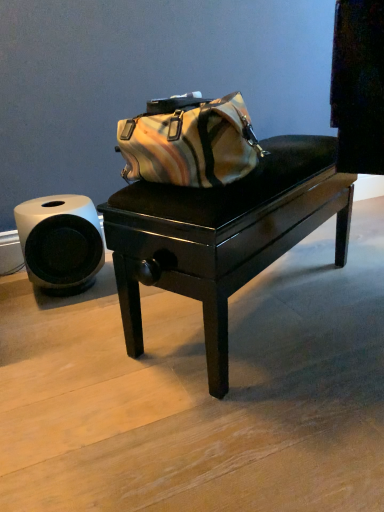
Question: From the image's perspective, is glossy black table at center over white matte toilet paper at left?

Choices:
 (A) no
 (B) yes

Answer: (B)

Question: Are glossy black table at center and white matte toilet paper at left far apart?

Choices:
 (A) no
 (B) yes

Answer: (A)

Question: From a real-world perspective, does glossy black table at center stand above white matte toilet paper at left?

Choices:
 (A) no
 (B) yes

Answer: (B)

Question: Could you tell me if glossy black table at center is turned towards white matte toilet paper at left?

Choices:
 (A) no
 (B) yes

Answer: (A)

Question: Is glossy black table at center further to camera compared to white matte toilet paper at left?

Choices:
 (A) no
 (B) yes

Answer: (A)

Question: Is glossy black table at center positioned with its back to white matte toilet paper at left?

Choices:
 (A) yes
 (B) no

Answer: (A)

Question: Can we say white matte toilet paper at left lies outside glossy black table at center?

Choices:
 (A) yes
 (B) no

Answer: (A)

Question: Is white matte toilet paper at left shorter than glossy black table at center?

Choices:
 (A) yes
 (B) no

Answer: (A)

Question: Does white matte toilet paper at left have a greater width compared to glossy black table at center?

Choices:
 (A) yes
 (B) no

Answer: (B)

Question: Considering the relative positions of white matte toilet paper at left and glossy black table at center in the image provided, is white matte toilet paper at left behind glossy black table at center?

Choices:
 (A) no
 (B) yes

Answer: (B)

Question: Considering the relative sizes of white matte toilet paper at left and glossy black table at center in the image provided, is white matte toilet paper at left taller than glossy black table at center?

Choices:
 (A) no
 (B) yes

Answer: (A)

Question: Considering the relative positions of white matte toilet paper at left and glossy black table at center in the image provided, is white matte toilet paper at left in front of glossy black table at center?

Choices:
 (A) yes
 (B) no

Answer: (B)

Question: From a real-world perspective, relative to white matte toilet paper at left, is glossy black table at center vertically above or below?

Choices:
 (A) above
 (B) below

Answer: (A)